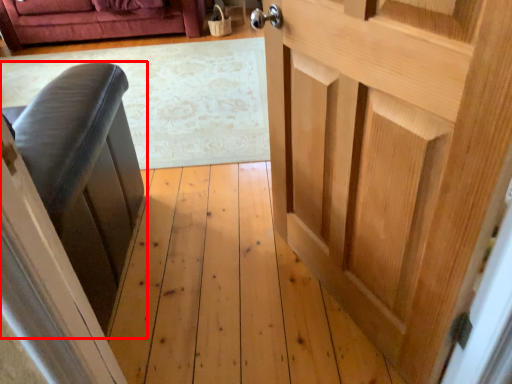
Question: Observing the image, what is the correct spatial positioning of furniture (annotated by the red box) in reference to door?

Choices:
 (A) left
 (B) right

Answer: (A)